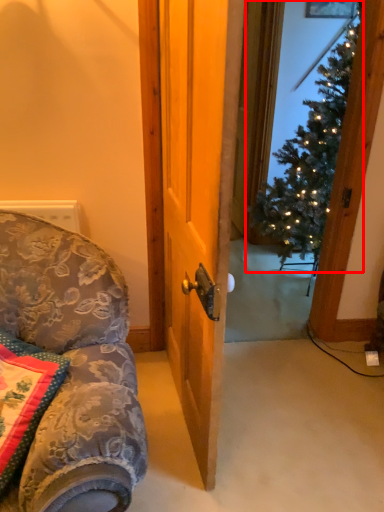
Question: From the image's perspective, considering the relative positions of christmas tree (annotated by the red box) and pillow in the image provided, where is christmas tree (annotated by the red box) located with respect to the staircase?

Choices:
 (A) above
 (B) below

Answer: (A)